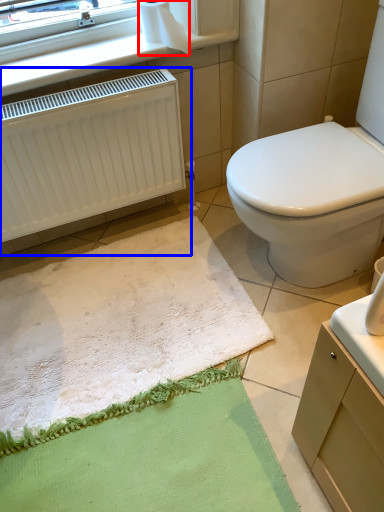
Question: Which object appears closest to the camera in this image, toilet paper (highlighted by a red box) or radiator (highlighted by a blue box)?

Choices:
 (A) toilet paper
 (B) radiator

Answer: (B)